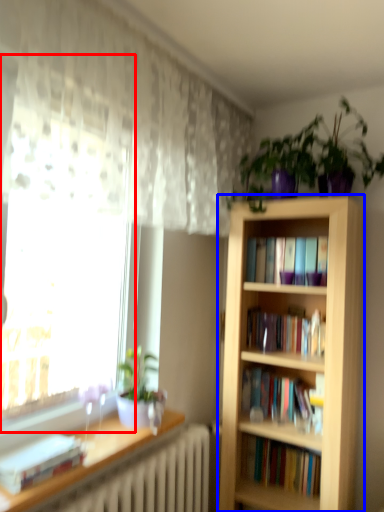
Question: Which point is further to the camera, bay window (highlighted by a red box) or bookcase (highlighted by a blue box)?

Choices:
 (A) bay window
 (B) bookcase

Answer: (B)